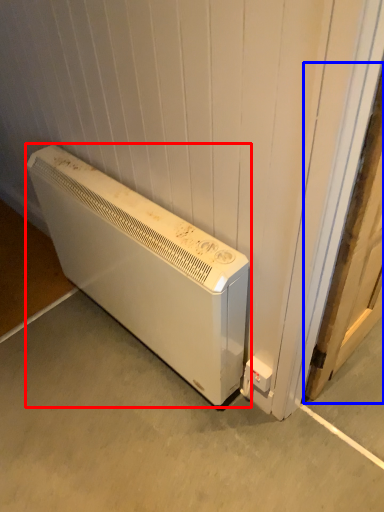
Question: Which object appears farthest to the camera in this image, home appliance (highlighted by a red box) or door (highlighted by a blue box)?

Choices:
 (A) home appliance
 (B) door

Answer: (A)